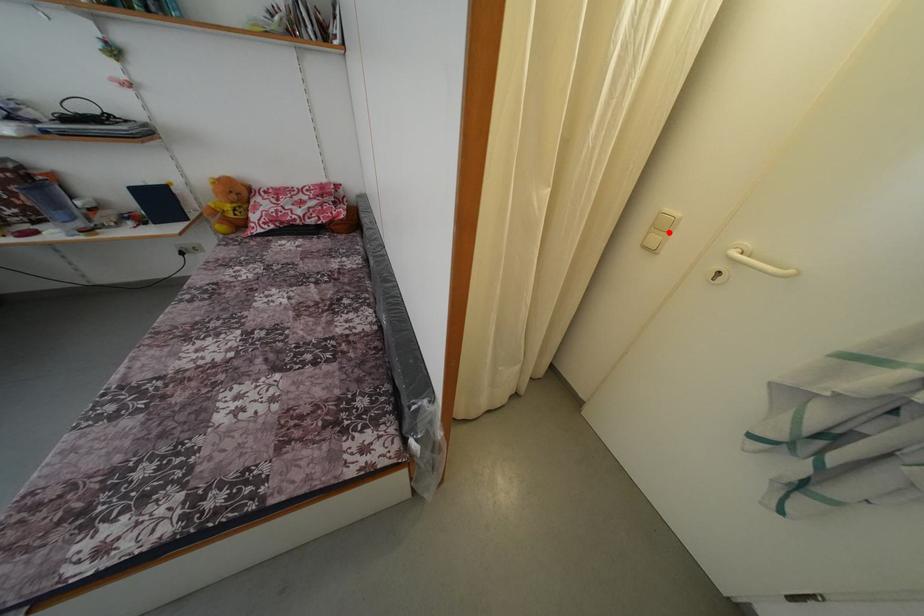
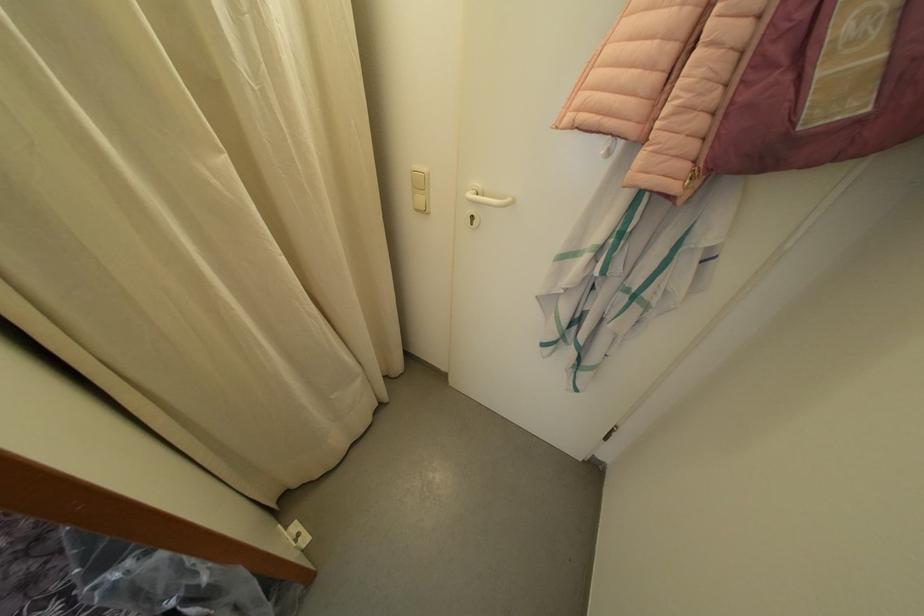
The point at the highlighted location is marked in the first image. Where is the corresponding point in the second image?

(427, 191)